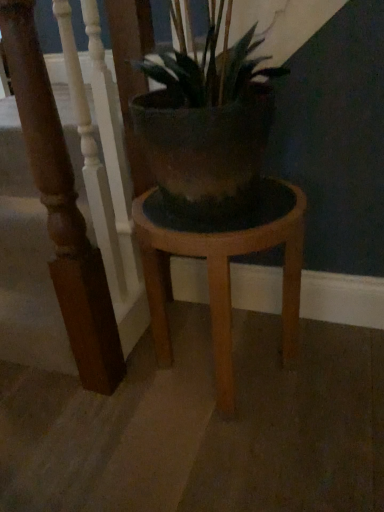
Identify the location of vacant space that is in between wooden stool at center and wooden stair rail at left. This screenshot has height=512, width=384. (170, 332).